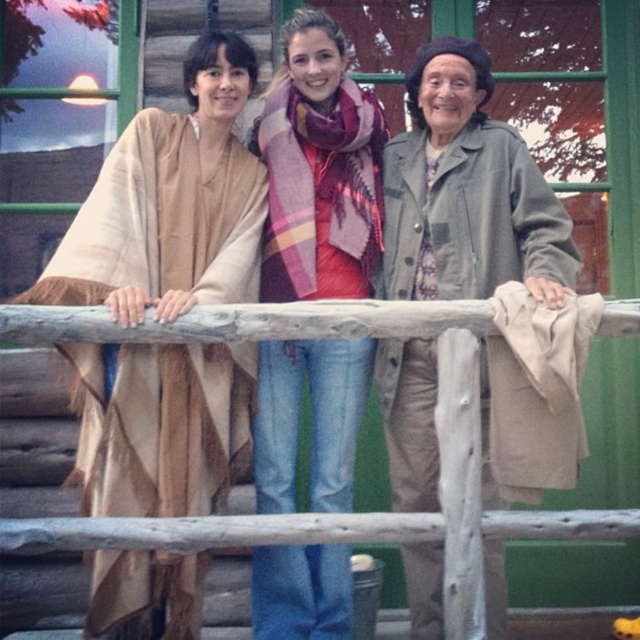
You are taking a photo of the three people leaning against the wooden railing in the image. You want to focus on the person at point (x=244, y=465) and the person at point (x=330, y=426). Which of these two points is closer to you?

Point (x=244, y=465) is closer to the viewer than point (x=330, y=426).

You are standing at the center of the image and want to hand a gift to the person wearing the beige woven poncho at left. In which direction should you move to reach them?

The beige woven poncho at left is located at point (170, 204), so you should move to the left to reach the person wearing the beige woven poncho at left.